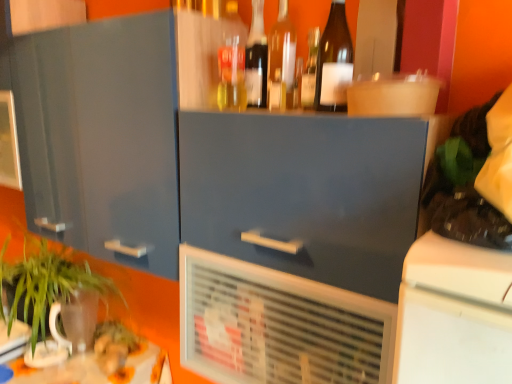
Question: From a real-world perspective, is translucent glass bottle at upper center, the 4th bottle viewed from the right, on top of translucent glass bottle at center, marked as the fourth bottle in a left-to-right arrangement?

Choices:
 (A) yes
 (B) no

Answer: (A)

Question: Considering the relative positions of translucent glass bottle at upper center, the 4th bottle viewed from the right, and translucent glass bottle at center, arranged as the 2th bottle when viewed from the right, in the image provided, is translucent glass bottle at upper center, the 4th bottle viewed from the right, in front of translucent glass bottle at center, arranged as the 2th bottle when viewed from the right,?

Choices:
 (A) no
 (B) yes

Answer: (A)

Question: From a real-world perspective, is translucent glass bottle at upper center, the 4th bottle viewed from the right, beneath translucent glass bottle at center, arranged as the 2th bottle when viewed from the right?

Choices:
 (A) yes
 (B) no

Answer: (B)

Question: Is translucent glass bottle at upper center, the 4th bottle viewed from the right, beside translucent glass bottle at center, arranged as the 2th bottle when viewed from the right?

Choices:
 (A) yes
 (B) no

Answer: (B)

Question: Does translucent glass bottle at upper center, which ranks as the second bottle in left-to-right order, have a greater height compared to translucent glass bottle at center, arranged as the 2th bottle when viewed from the right?

Choices:
 (A) yes
 (B) no

Answer: (A)

Question: Considering the relative sizes of translucent glass bottle at upper center, which ranks as the second bottle in left-to-right order, and translucent glass bottle at center, marked as the fourth bottle in a left-to-right arrangement, in the image provided, is translucent glass bottle at upper center, which ranks as the second bottle in left-to-right order, wider than translucent glass bottle at center, marked as the fourth bottle in a left-to-right arrangement,?

Choices:
 (A) no
 (B) yes

Answer: (B)

Question: Does green leafy plant at lower left have a greater height compared to matte gray cabinet at center, the 1th cabinetry in the right-to-left sequence?

Choices:
 (A) yes
 (B) no

Answer: (A)

Question: From a real-world perspective, does green leafy plant at lower left sit lower than matte gray cabinet at center, the 1th cabinetry in the right-to-left sequence?

Choices:
 (A) yes
 (B) no

Answer: (A)

Question: Is the position of green leafy plant at lower left more distant than that of matte gray cabinet at center, the 1th cabinetry in the right-to-left sequence?

Choices:
 (A) no
 (B) yes

Answer: (B)

Question: Is green leafy plant at lower left not close to matte gray cabinet at center, acting as the second cabinetry starting from the left?

Choices:
 (A) yes
 (B) no

Answer: (B)

Question: Is green leafy plant at lower left next to matte gray cabinet at center, acting as the second cabinetry starting from the left, and touching it?

Choices:
 (A) no
 (B) yes

Answer: (A)

Question: Can you confirm if green leafy plant at lower left is wider than matte gray cabinet at center, acting as the second cabinetry starting from the left?

Choices:
 (A) no
 (B) yes

Answer: (B)

Question: Can you confirm if matte gray cabinet at center, the 1th cabinetry in the right-to-left sequence, is bigger than white plastic air conditioning unit at center?

Choices:
 (A) no
 (B) yes

Answer: (B)